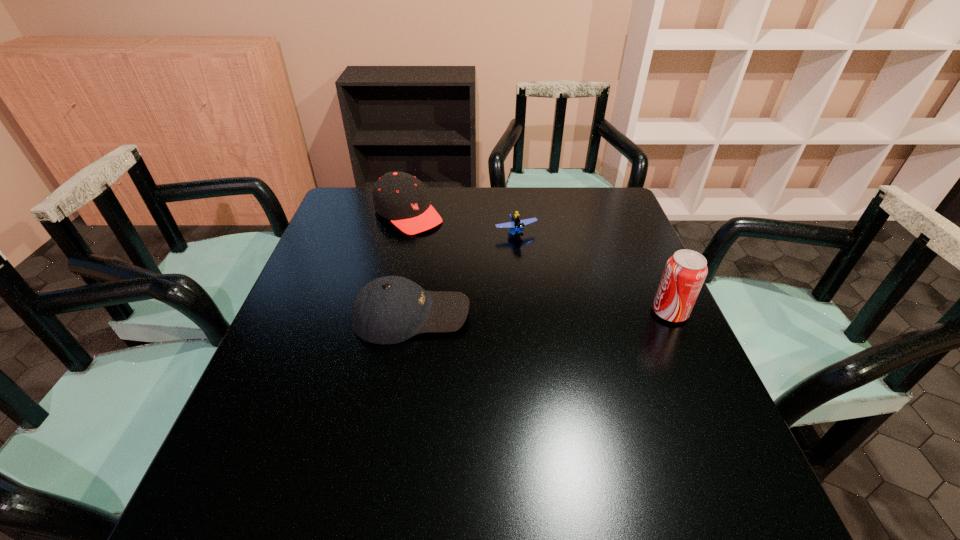
Locate an element on the screen. This screenshot has width=960, height=540. object present at the right edge is located at coordinates (685, 272).

I want to click on object present at the far left corner, so click(x=400, y=197).

Locate an element on the screen. The height and width of the screenshot is (540, 960). free location at the far edge is located at coordinates (563, 195).

You are a GUI agent. You are given a task and a screenshot of the screen. Output one action in this format:
    pyautogui.click(x=<x>, y=<y>)
    Task: Click on the free space at the near edge
    This screenshot has height=540, width=960.
    Given the screenshot: What is the action you would take?
    pyautogui.click(x=490, y=448)

Where is `free region at the left edge of the desktop`? This screenshot has width=960, height=540. free region at the left edge of the desktop is located at coordinates (324, 278).

Where is `free region at the right edge of the desktop`? Image resolution: width=960 pixels, height=540 pixels. free region at the right edge of the desktop is located at coordinates pyautogui.click(x=628, y=342).

This screenshot has width=960, height=540. In the image, there is a desktop. In order to click on free space at the far left corner in this screenshot , I will do `click(380, 223)`.

Locate an element on the screen. vacant space at the near right corner is located at coordinates (693, 426).

Find the location of a particular element. The width and height of the screenshot is (960, 540). free space between the third tallest object and the Lego is located at coordinates (464, 274).

At what (x,y) coordinates should I click in order to perform the action: click on free space between the third tallest object and the shortest object. Please return your answer as a coordinate pair (x, y). Looking at the image, I should click on (464, 274).